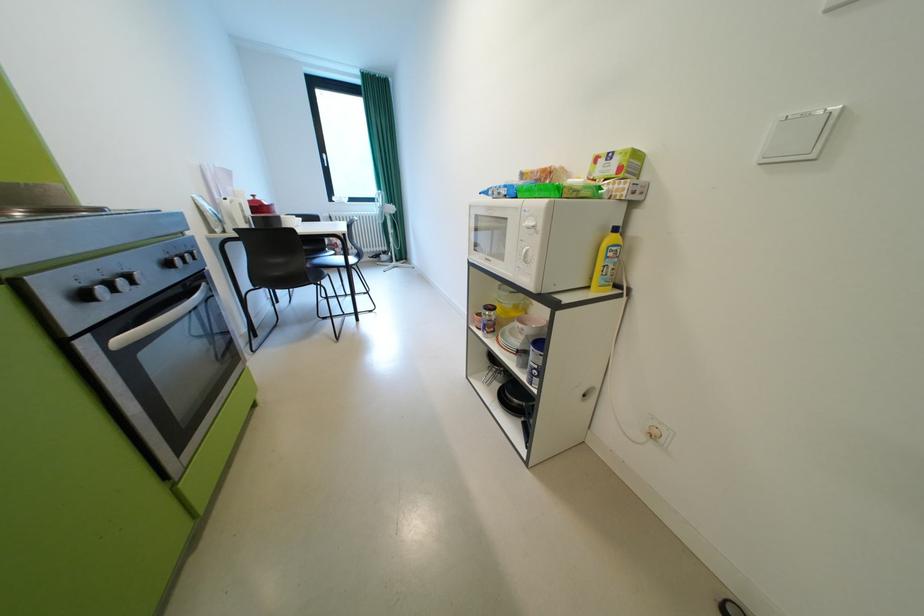
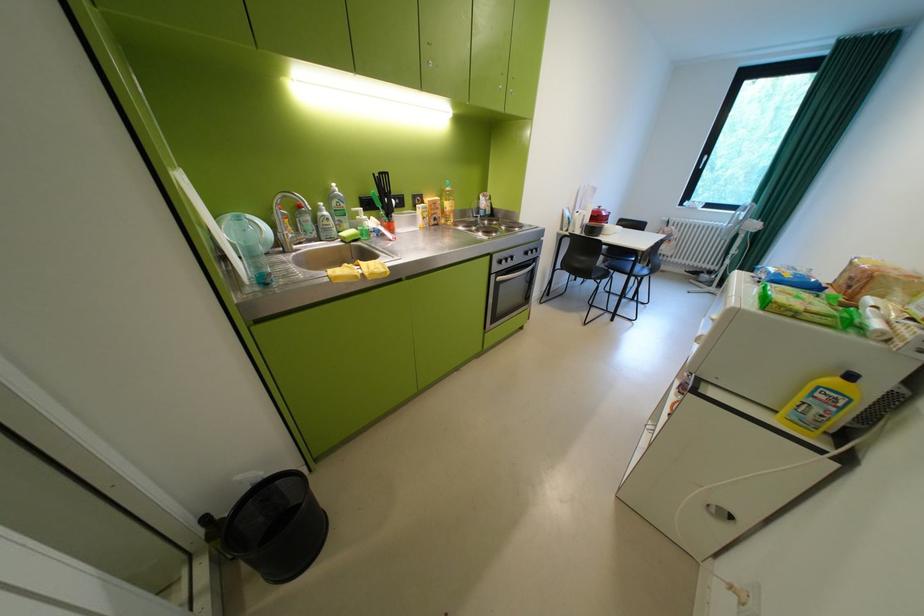
The point at (189, 408) is marked in the first image. Where is the corresponding point in the second image?

(511, 310)